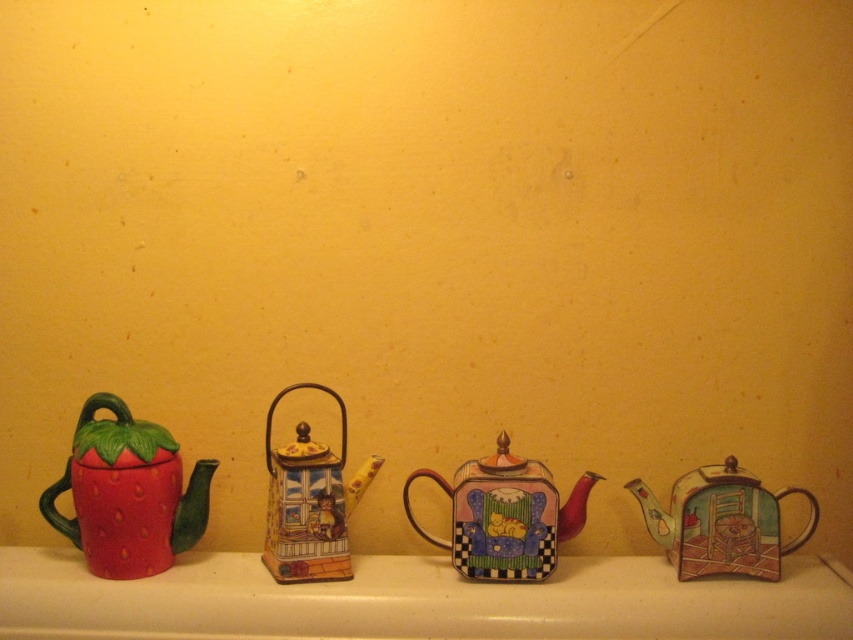
You are standing in front of the image and want to place a new teapot exactly where the white glossy window sill at center is located. Is there already an object occupying that spot?

Yes, the white glossy window sill at center is already located at point (416, 600), so placing another object there would overlap.

You are arranging flowers in the center of the white glossy window sill at center. If you want to place a teapot next to it, which teapot from the scene would be closest to the window sill?

The second teapot, which has a rectangular shape with a cat on a window illustration, is closest to the white glossy window sill at center because it is positioned next to it in the arrangement.

You are arranging flowers on the white glossy window sill at center and need to place a vase that is 10 cm tall. The multicolored ceramic teapot at center is currently occupying space above the window sill. Is there enough vertical space between the window sill and the teapot to place the vase?

The white glossy window sill at center is located below the multicolored ceramic teapot at center, so there is vertical space between them. However, the exact height isn example provided in the Objects Description. Without knowing the distance between the window sill and the teapot, it is impossible to determine if the 10 cm tall vase will fit.